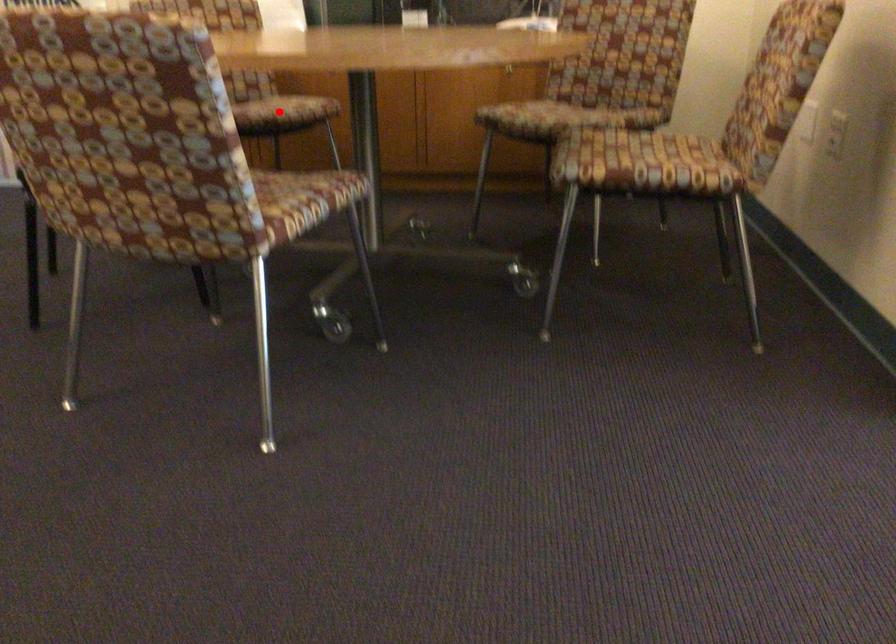
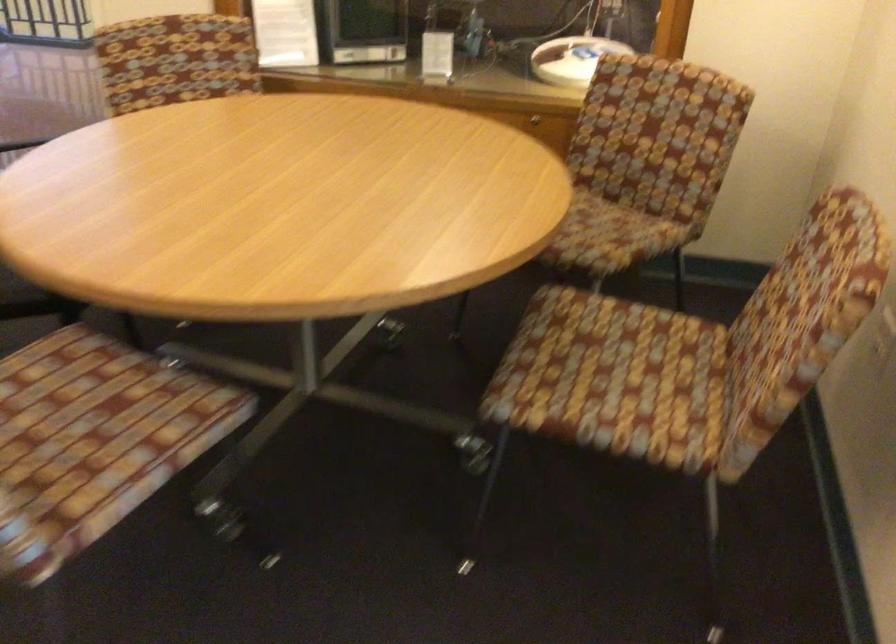
Question: I am providing you with two images of the same scene from different viewpoints. A red point is marked on the first image. Can you still see the location of the red point in image 2?

Choices:
 (A) Yes
 (B) No

Answer: (B)